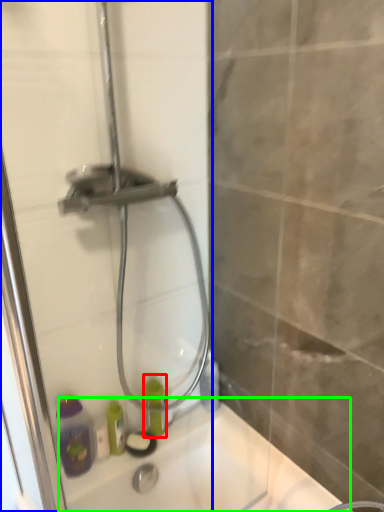
Question: Estimate the real-world distances between objects in this image. Which object is closer to bottle (highlighted by a red box), shower door (highlighted by a blue box) or bath (highlighted by a green box)?

Choices:
 (A) shower door
 (B) bath

Answer: (B)